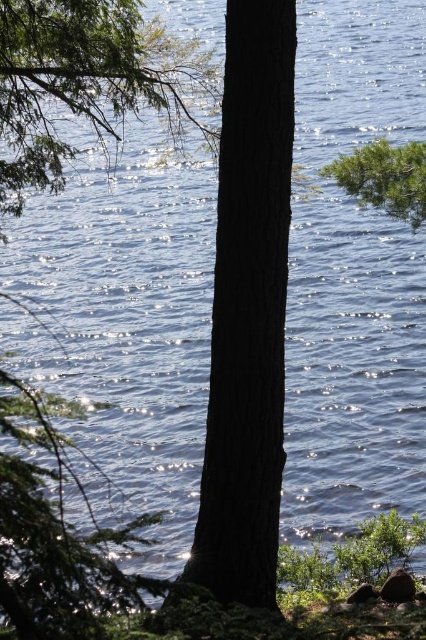
Question: Does smooth bark tree at center have a greater width compared to green matte tree trunk at center?

Choices:
 (A) yes
 (B) no

Answer: (A)

Question: Can you confirm if smooth bark tree at center is positioned below green matte tree trunk at center?

Choices:
 (A) no
 (B) yes

Answer: (B)

Question: Does smooth bark tree at center have a larger size compared to green matte tree trunk at center?

Choices:
 (A) yes
 (B) no

Answer: (A)

Question: Which of the following is the farthest from the observer?

Choices:
 (A) smooth bark tree at center
 (B) green matte tree trunk at center

Answer: (B)

Question: Which object is closer to the camera taking this photo?

Choices:
 (A) green matte tree trunk at center
 (B) smooth bark tree at center

Answer: (B)